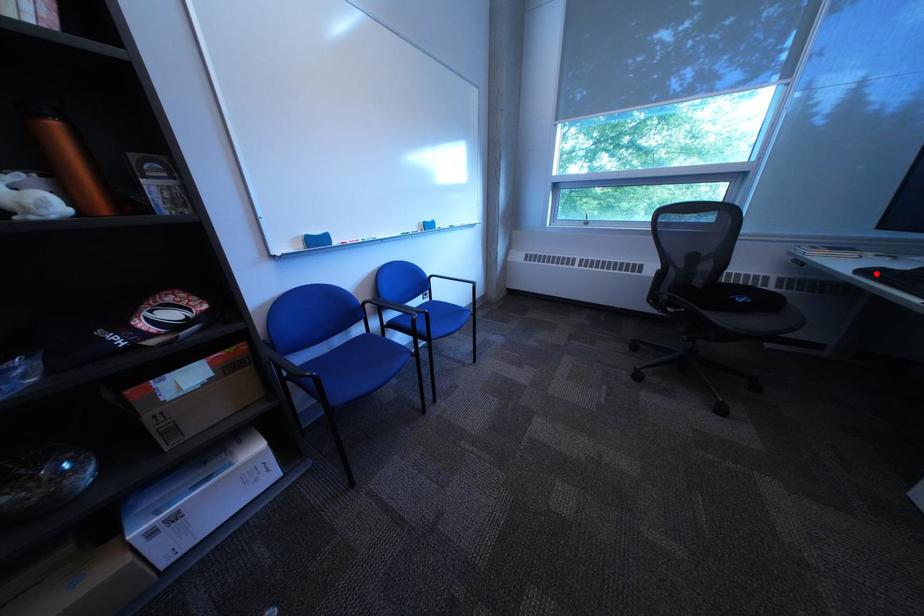
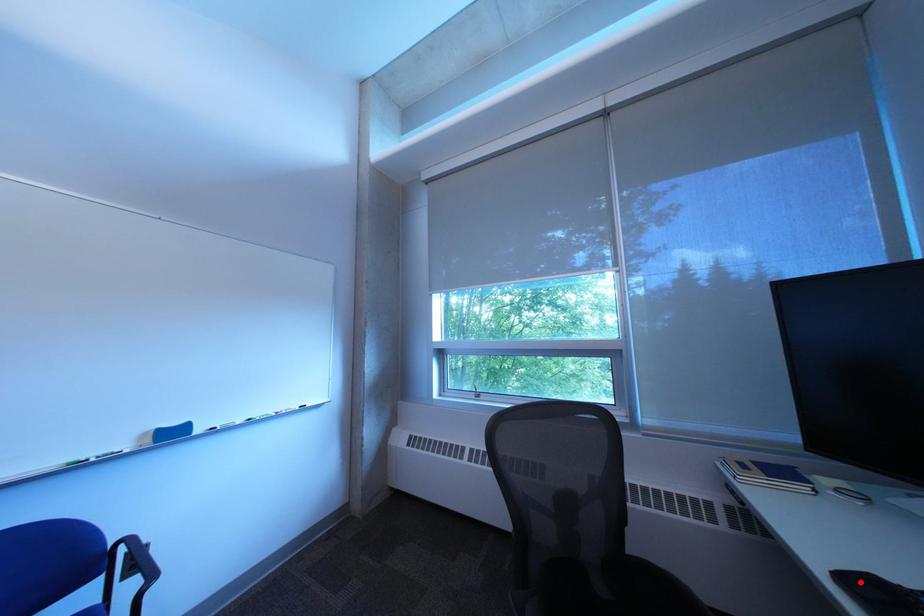
I am providing you with two images of the same scene from different viewpoints. A red point is marked on the first image and another point is marked on the second image. Are the points marked in image1 and image2 representing the same 3D position?

Yes